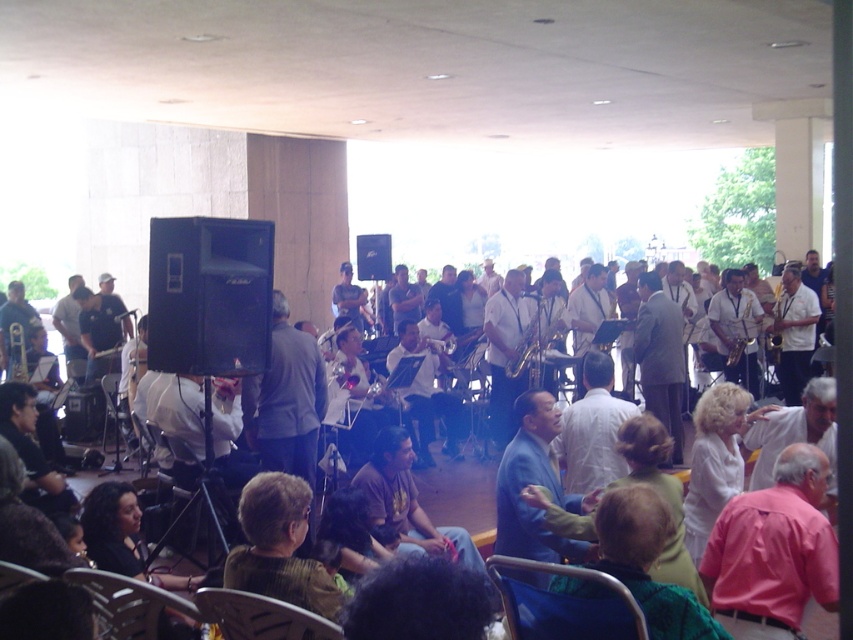
You are a stagehand preparing to move the metallic blue chair at lower center and the matte gray suit at center to the storage room. The storage room has a narrow doorway that only allows items less than 12 inches in width to pass through. Which item should you move first to ensure it fits through the doorway?

The metallic blue chair at lower center is thinner than the matte gray suit at center, so you should move the metallic blue chair at lower center first since it is more likely to fit through the narrow doorway.

You are standing at the origin point of the coordinate system in the image. There are two points marked in the scene. The first point is at coordinate point (836, 572) and the second point is at coordinate point (576, 628). Which point is located further back from your current position?

Point (836, 572) is behind point (576, 628), so it is further back from your current position.

Looking at this image, you are trying to decide where to sit during the outdoor musical performance. You have a choice between the green fabric chair at lower center and the plastic seat at lower left. Which seat has a larger width?

The green fabric chair at lower center might be wider than plastic seat at lower left.